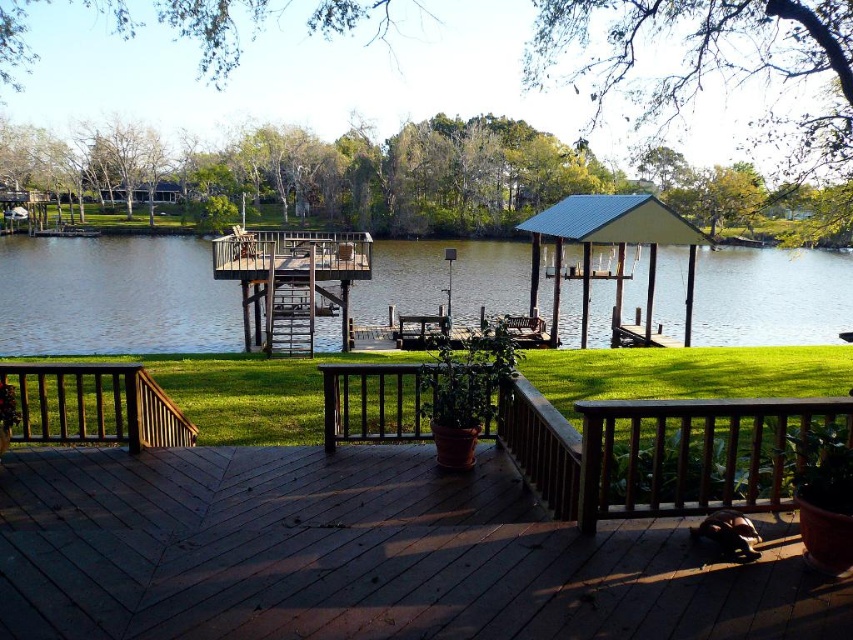
Question: Which of the following is the farthest from the observer?

Choices:
 (A) clear water at center
 (B) brown wooden gazebo at center
 (C) wooden deck at center

Answer: (A)

Question: Which object is the farthest from the brown wooden rail at lower left?

Choices:
 (A) wooden deck at center
 (B) brown wooden rail at lower right
 (C) brown wooden gazebo at center

Answer: (C)

Question: Is brown wooden rail at lower right to the right of brown wooden gazebo at center from the viewer's perspective?

Choices:
 (A) no
 (B) yes

Answer: (B)

Question: Can you confirm if wooden deck at center is bigger than brown wooden rail at lower left?

Choices:
 (A) no
 (B) yes

Answer: (B)

Question: Which point appears farthest from the camera in this image?

Choices:
 (A) (607, 323)
 (B) (277, 324)
 (C) (415, 557)

Answer: (A)

Question: Does brown wooden rail at lower right have a smaller size compared to metallic blue gazebo at center?

Choices:
 (A) no
 (B) yes

Answer: (B)